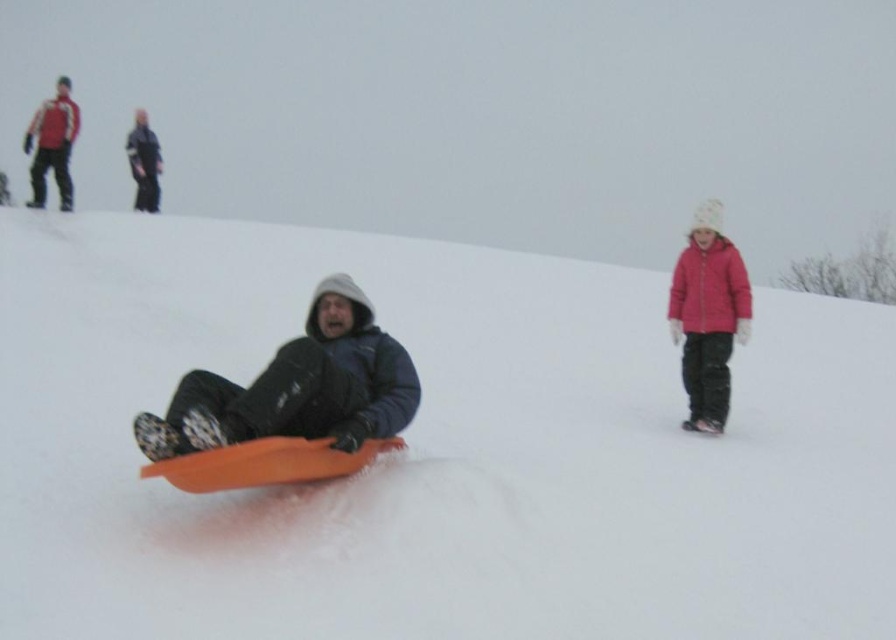
Consider the image. You are standing at the origin point in the image. Which direction should you move to reach the matte black jacket at center?

The matte black jacket at center is located at point 0.605 on the x axis and 0.334 on the y axis. Since you are at the origin, you should move towards the right and slightly upwards to reach it.

Looking at this image, you are standing in the snowy scene and want to place a small flag at the point that is closer to you. Which point should you choose between point (304, 380) and point (739, 333)?

You should choose point (304, 380) because it is closer to the viewer than point (739, 333).

You are a photographer trying to capture the best shot of the two points in the scene. Which point, point (59, 156) or point (136, 198), would appear larger in your photo?

Point (59, 156) is closer to the camera than point (136, 198), so it would appear larger in the photo.